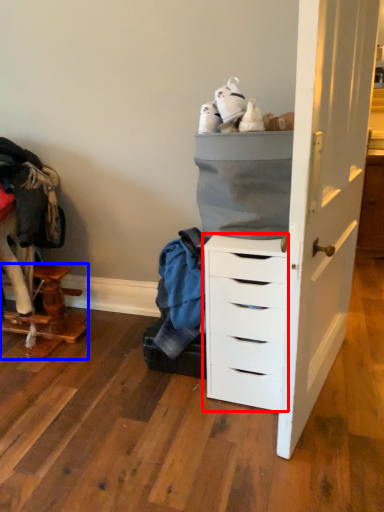
Question: Which point is further to the camera, chest of drawers (highlighted by a red box) or furniture (highlighted by a blue box)?

Choices:
 (A) chest of drawers
 (B) furniture

Answer: (B)